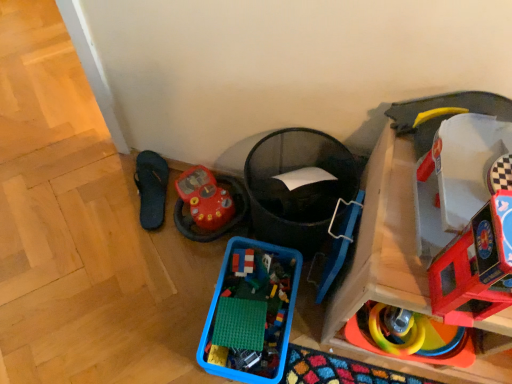
Where is `empty space that is ontop of blue plastic container at lower center, which is the third toy from left to right`? empty space that is ontop of blue plastic container at lower center, which is the third toy from left to right is located at coordinates (239, 326).